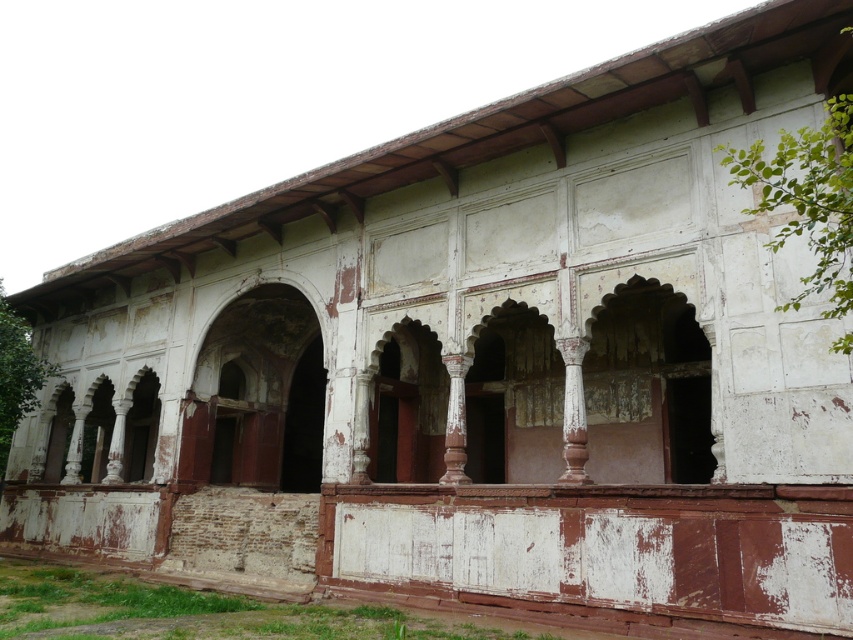
Consider the image. Does rusty metal archway at center have a smaller size compared to reddish-brown polished pillar at center?

Yes, rusty metal archway at center is smaller than reddish-brown polished pillar at center.

What do you see at coordinates (257, 396) in the screenshot? The height and width of the screenshot is (640, 853). I see `rusty metal archway at center` at bounding box center [257, 396].

Which is behind, point (297, 458) or point (445, 368)?

Point (297, 458)

What are the coordinates of `rusty metal archway at center` in the screenshot? It's located at (257, 396).

Who is positioned more to the right, rustic stone archway at center or reddish-brown polished pillar at center?

reddish-brown polished pillar at center is more to the right.

Can you confirm if rustic stone archway at center is positioned to the left of reddish-brown polished pillar at center?

Indeed, rustic stone archway at center is positioned on the left side of reddish-brown polished pillar at center.

Is point (427, 344) behind point (445, 422)?

Yes.

Identify the location of rustic stone archway at center. (408, 406).

Does rusty metal archway at center appear over rustic stone archway at center?

Actually, rusty metal archway at center is below rustic stone archway at center.

This screenshot has height=640, width=853. Find the location of `rusty metal archway at center`. rusty metal archway at center is located at coordinates (257, 396).